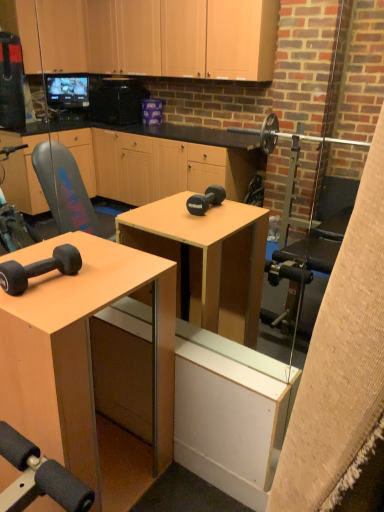
The width and height of the screenshot is (384, 512). Identify the location of vacant space in front of matte black dumbbell at lower left. pos(43,308).